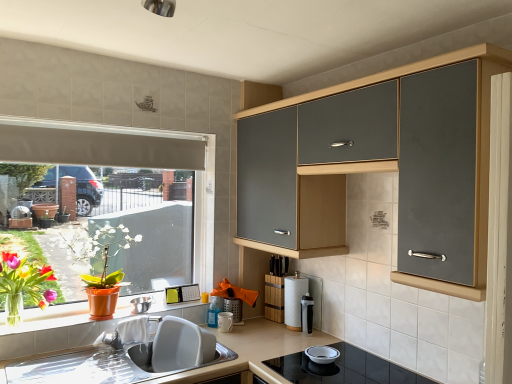
Where is `blank space situated above white matte exhaust hood at upper left (from a real-world perspective)`? This screenshot has width=512, height=384. blank space situated above white matte exhaust hood at upper left (from a real-world perspective) is located at coordinates (82, 132).